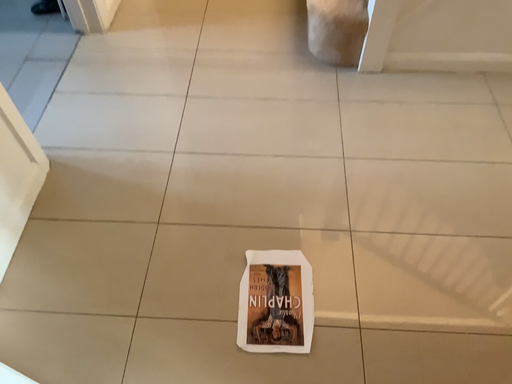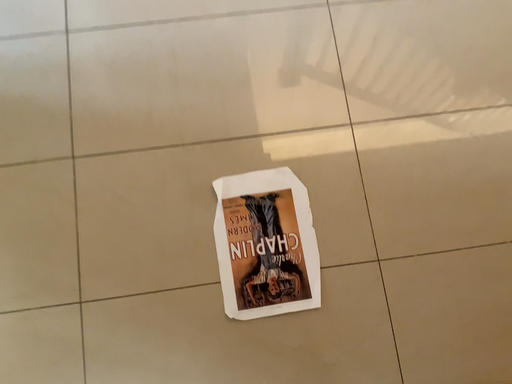
Question: Which way did the camera rotate in the video?

Choices:
 (A) rotated downward
 (B) rotated upward

Answer: (A)